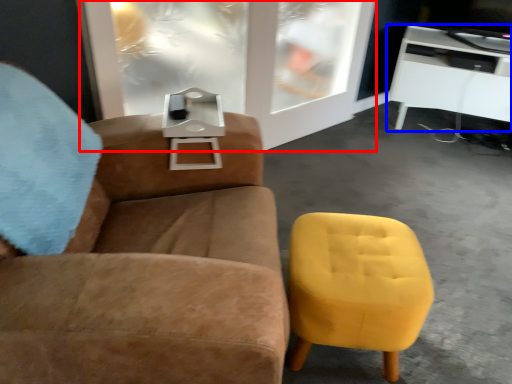
Question: Which point is closer to the camera, glass door (highlighted by a red box) or table (highlighted by a blue box)?

Choices:
 (A) glass door
 (B) table

Answer: (A)